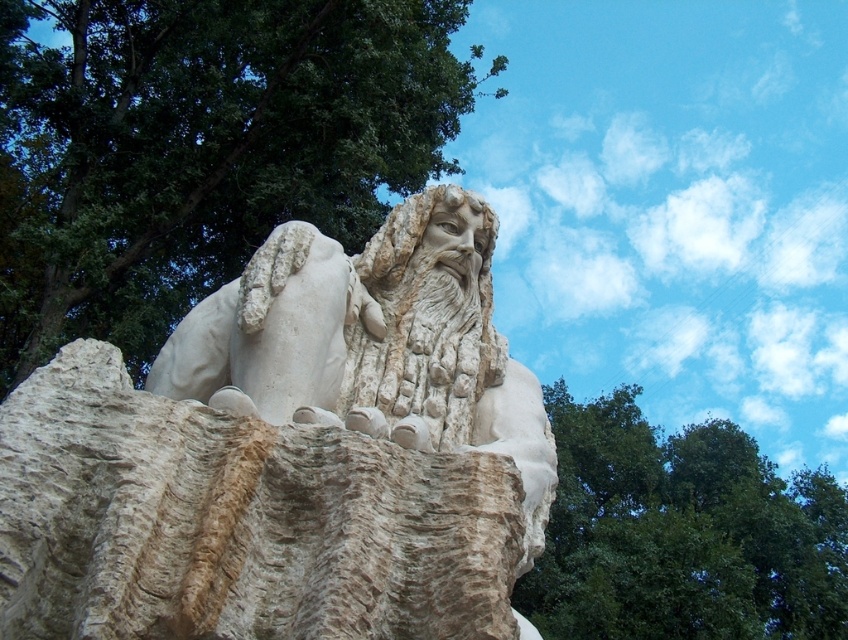
You are standing in front of the stone sculpture and want to take a photo that includes both the green leafy tree at upper left and the green leafy tree at upper right. Which direction should you move to ensure both trees are in the frame?

You should move to the left so that both the green leafy tree at upper left and the green leafy tree at upper right can be captured in the photo frame since the green leafy tree at upper left is positioned to the left of the green leafy tree at upper right.

You are standing in front of the stone sculpture and want to determine which of the green leafy tree at upper left and green leafy tree at upper right is taller. Based on the scene, which tree is taller?

The green leafy tree at upper left is taller than the green leafy tree at upper right.